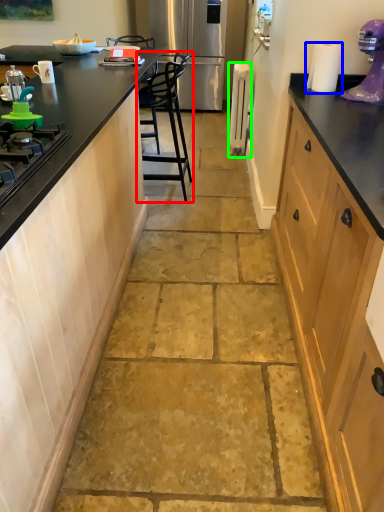
Question: Based on their relative distances, which object is farther from chair (highlighted by a red box)? Choose from paper towel (highlighted by a blue box) and appliance (highlighted by a green box).

Choices:
 (A) paper towel
 (B) appliance

Answer: (B)